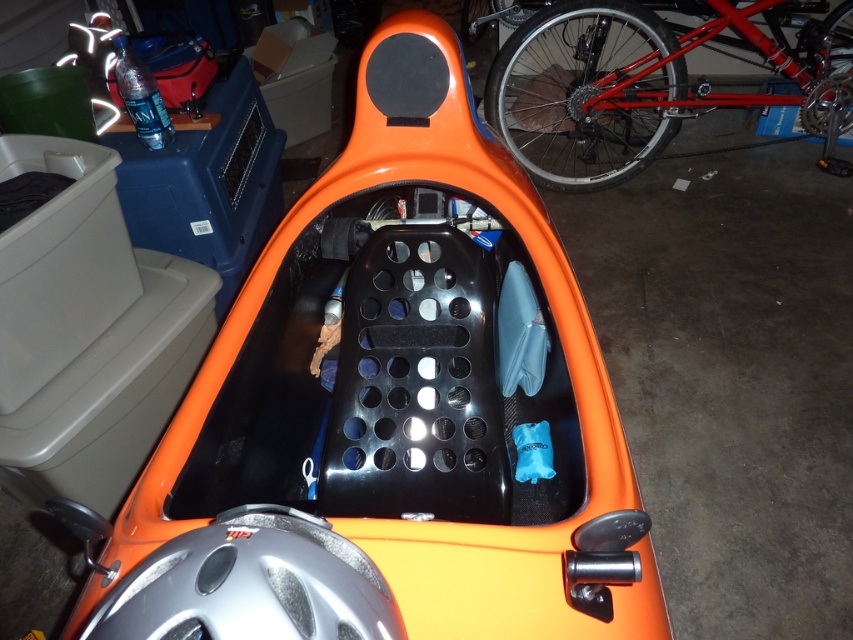
Question: Which point is farther to the camera?

Choices:
 (A) shiny red metal bicycle at upper right
 (B) orange glossy car at center
 (C) silver textured helmet at lower left
 (D) shiny metallic tire at upper right

Answer: (D)

Question: Is the position of orange glossy car at center less distant than that of shiny red metal bicycle at upper right?

Choices:
 (A) no
 (B) yes

Answer: (B)

Question: Is orange glossy car at center thinner than shiny red metal bicycle at upper right?

Choices:
 (A) no
 (B) yes

Answer: (B)

Question: Among these points, which one is nearest to the camera?

Choices:
 (A) pos(850,70)
 (B) pos(577,554)

Answer: (B)

Question: Which point is farther to the camera?

Choices:
 (A) shiny metallic tire at upper right
 (B) shiny red metal bicycle at upper right
 (C) silver textured helmet at lower left
 (D) orange glossy car at center

Answer: (A)

Question: Is orange glossy car at center further to the viewer compared to shiny red metal bicycle at upper right?

Choices:
 (A) yes
 (B) no

Answer: (B)